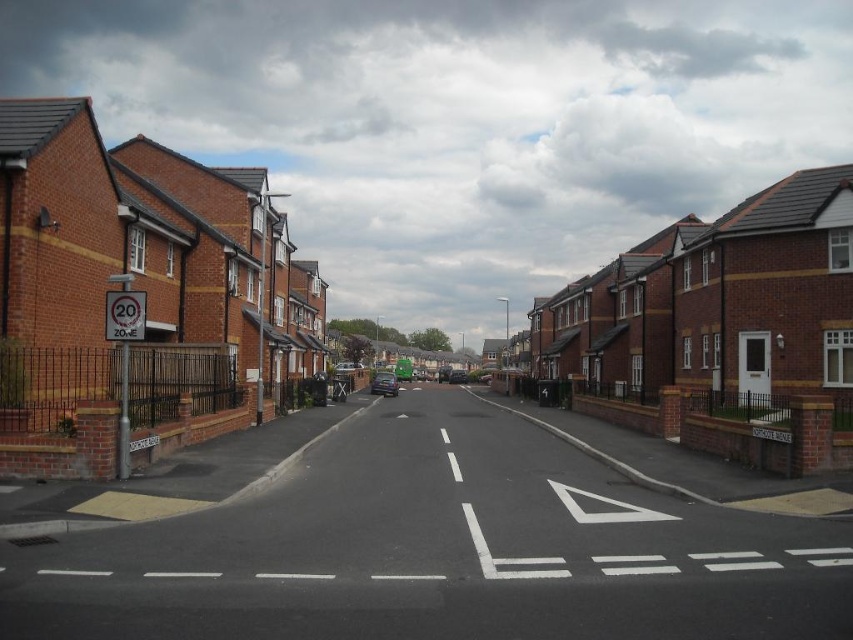
Between metallic blue car at center and shiny black car at center, which one has more height?

With more height is metallic blue car at center.

Between point (386, 381) and point (457, 378), which one is positioned in front?

Point (386, 381) is more forward.

Who is more distant from viewer, (381, 390) or (457, 371)?

The point (457, 371) is behind.

Locate an element on the screen. This screenshot has height=640, width=853. metallic blue car at center is located at coordinates (384, 384).